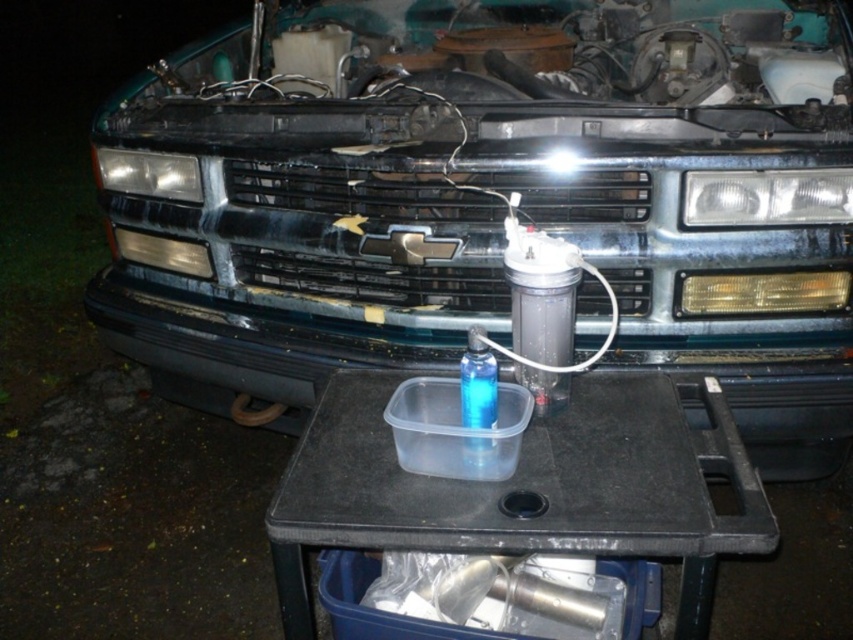
Is point (750, 234) behind point (850, 182)?

Yes.

From the picture: Can you confirm if glossy metallic car at center is taller than matte plastic headlight at right?

Correct, glossy metallic car at center is much taller as matte plastic headlight at right.

Is point (846, 376) farther from viewer compared to point (822, 205)?

Yes, point (846, 376) is behind point (822, 205).

This screenshot has height=640, width=853. Identify the location of glossy metallic car at center. (491, 196).

Does point (787, 202) come closer to viewer compared to point (477, 416)?

No, it is not.

Can you confirm if matte plastic headlight at right is smaller than transparent plastic bottle at center?

Indeed, matte plastic headlight at right has a smaller size compared to transparent plastic bottle at center.

Does point (717, 202) lie behind point (467, 362)?

Yes, it is behind point (467, 362).

The width and height of the screenshot is (853, 640). What are the coordinates of `matte plastic headlight at right` in the screenshot? It's located at (767, 196).

Does matte black headlight at left appear on the left side of transparent plastic bottle at center?

Yes, matte black headlight at left is to the left of transparent plastic bottle at center.

Consider the image. Can you confirm if matte black headlight at left is shorter than transparent plastic bottle at center?

Yes, matte black headlight at left is shorter than transparent plastic bottle at center.

Image resolution: width=853 pixels, height=640 pixels. In order to click on matte black headlight at left in this screenshot , I will do `click(148, 173)`.

At what (x,y) coordinates should I click in order to perform the action: click on matte black headlight at left. Please return your answer as a coordinate pair (x, y). The height and width of the screenshot is (640, 853). Looking at the image, I should click on (148, 173).